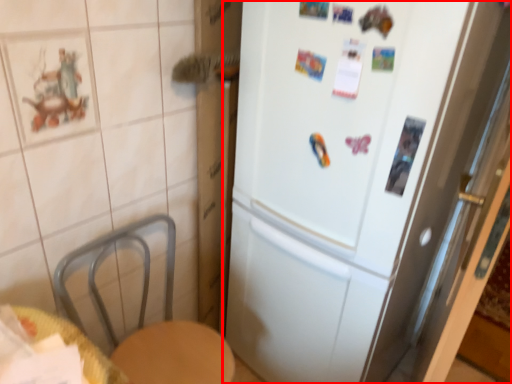
Question: From the image, what is the correct spatial relationship of refrigerator (annotated by the red box) in relation to table?

Choices:
 (A) left
 (B) right

Answer: (B)